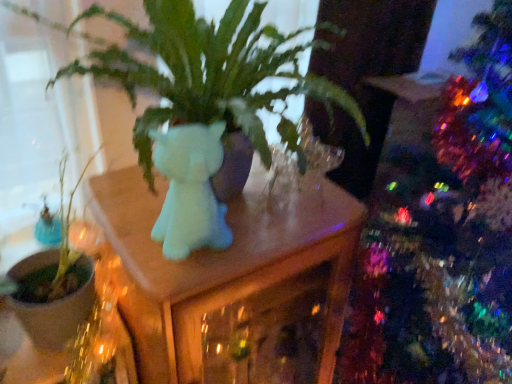
Locate an element on the screen. The width and height of the screenshot is (512, 384). free space to the left of matte white cat at center is located at coordinates (124, 217).